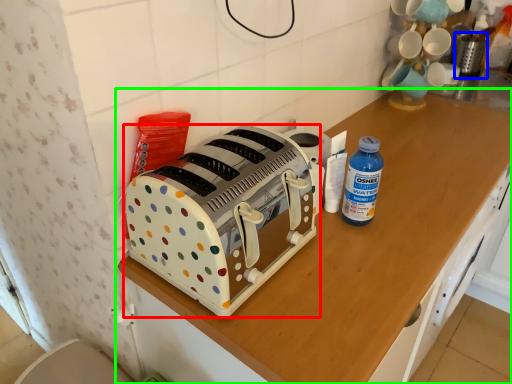
Question: Which object is positioned closest to toaster (highlighted by a red box)? Select from appliance (highlighted by a blue box) and cabinetry (highlighted by a green box).

Choices:
 (A) appliance
 (B) cabinetry

Answer: (B)